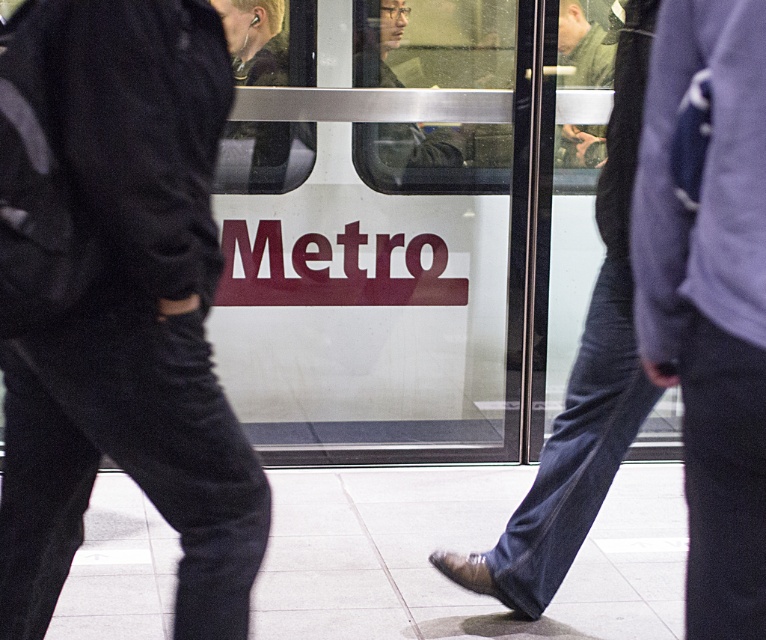
Question: Can you confirm if purple sweater at right is smaller than green matte jacket at center?

Choices:
 (A) no
 (B) yes

Answer: (A)

Question: Does black matte pants at left have a larger size compared to purple sweater at right?

Choices:
 (A) no
 (B) yes

Answer: (B)

Question: Which object is closer to the camera taking this photo?

Choices:
 (A) green matte jacket at center
 (B) purple sweater at right

Answer: (B)

Question: Does dark blue jeans at center appear under green matte jacket at center?

Choices:
 (A) no
 (B) yes

Answer: (B)

Question: Which of these objects is positioned farthest from the purple sweater at right?

Choices:
 (A) dark blue jeans at center
 (B) matte black jacket at center
 (C) black matte pants at left
 (D) green matte jacket at center

Answer: (D)

Question: Based on their relative distances, which object is nearer to the black matte pants at left?

Choices:
 (A) matte black jacket at center
 (B) dark blue jeans at center

Answer: (B)